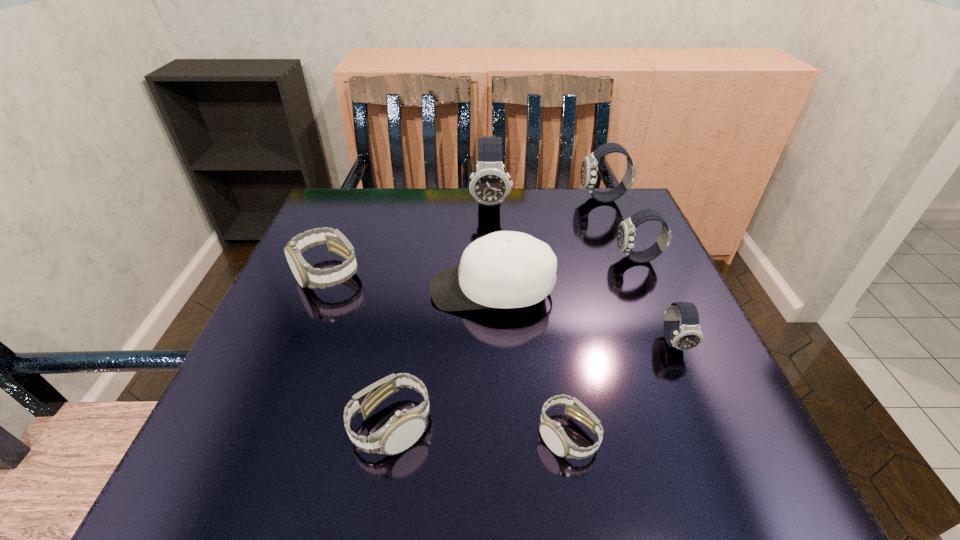
Select which watch is the fourth closest to the leftmost white watch. Please provide its 2D coordinates. Your answer should be formatted as a tuple, i.e. [(x, y)], where the tuple contains the x and y coordinates of a point satisfying the conditions above.

[(959, 0)]

In order to click on watch object that ranks as the closest to the third watch from left to right in this screenshot , I will do `click(959, 0)`.

Locate an element on the screen. Image resolution: width=960 pixels, height=540 pixels. the third closest dark watch relative to the shortest watch is located at coordinates (959, 0).

At what (x,y) coordinates should I click in order to perform the action: click on dark watch that is the third closest to the second biggest dark watch. Please return your answer as a coordinate pair (x, y). The height and width of the screenshot is (540, 960). Looking at the image, I should click on (959, 539).

Identify which white watch is the third closest to the third nearest object. Please provide its 2D coordinates. Your answer should be formatted as a tuple, i.e. [(x, y)], where the tuple contains the x and y coordinates of a point satisfying the conditions above.

[(959, 0)]

Select which white watch is the third closest to the second smallest dark watch. Please provide its 2D coordinates. Your answer should be formatted as a tuple, i.e. [(x, y)], where the tuple contains the x and y coordinates of a point satisfying the conditions above.

[(959, 0)]